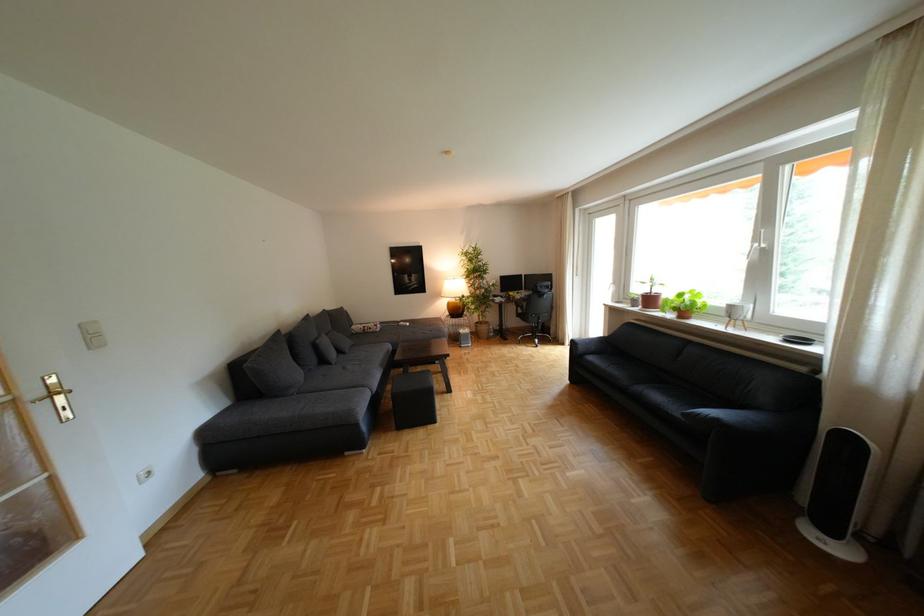
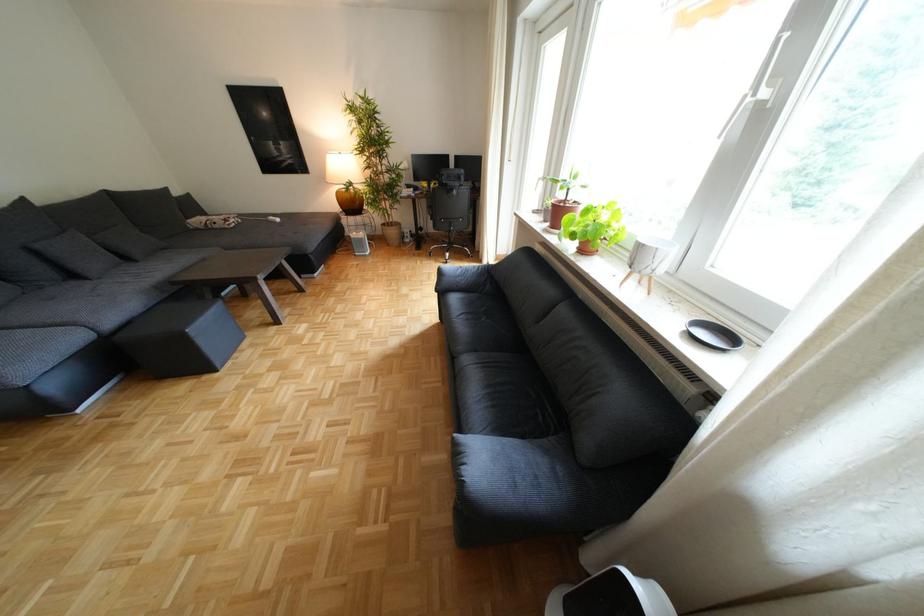
In the second image, find the point that corresponds to pixel 329 347 in the first image.

(49, 253)